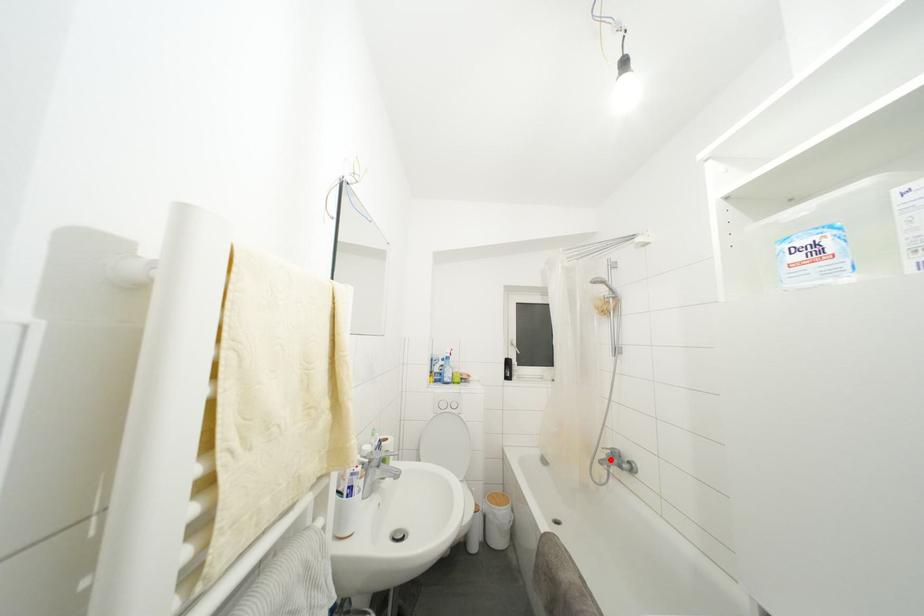
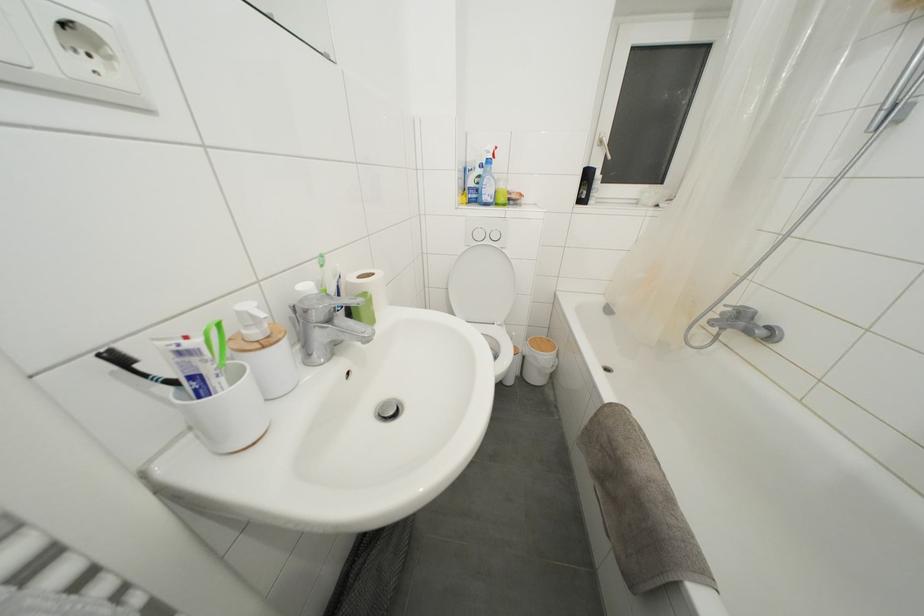
Locate, in the second image, the point that corresponds to the highlighted location in the first image.

(726, 318)